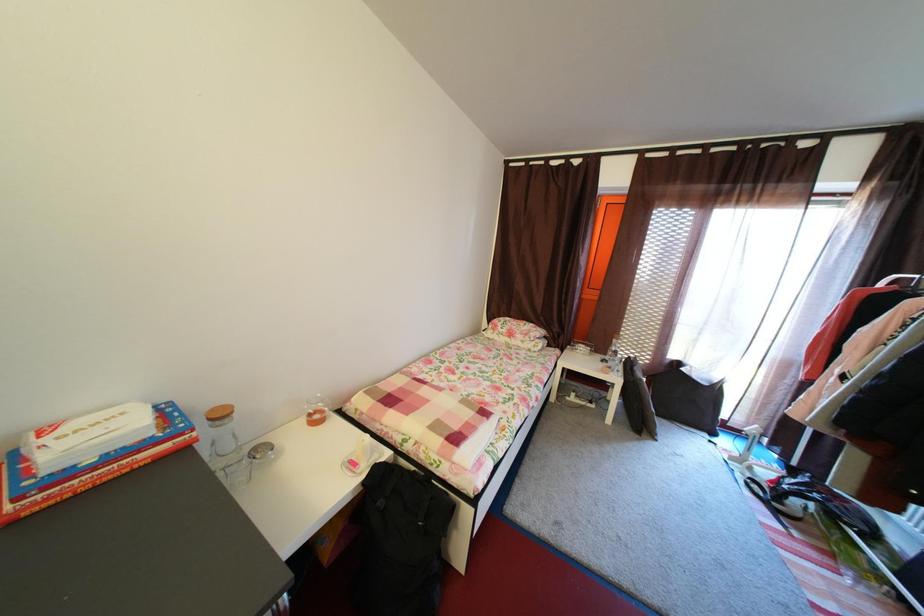
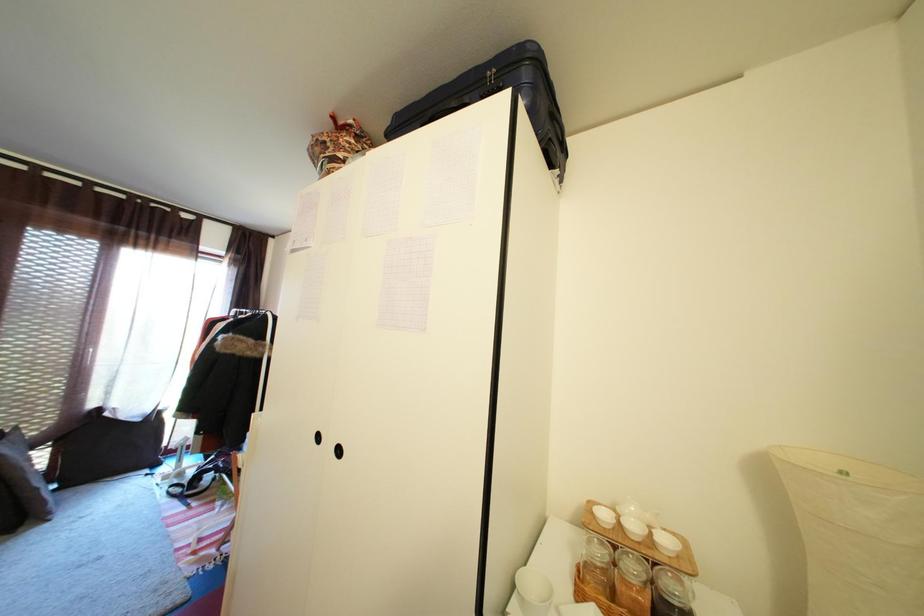
Question: The camera is either moving clockwise (left) or counter-clockwise (right) around the object. The first image is from the beginning of the video and the second image is from the end. Is the camera moving left or right when shooting the video?

Choices:
 (A) Left
 (B) Right

Answer: (A)